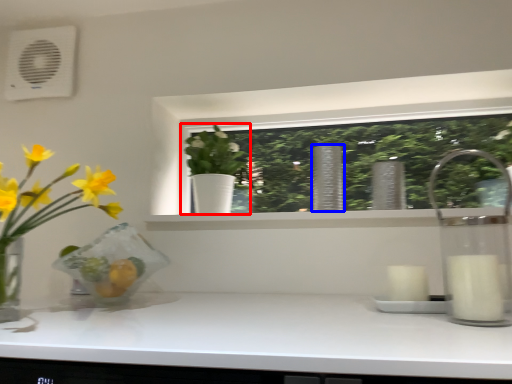
Question: Which of the following is the closest to the observer, houseplant (highlighted by a red box) or vase (highlighted by a blue box)?

Choices:
 (A) houseplant
 (B) vase

Answer: (B)